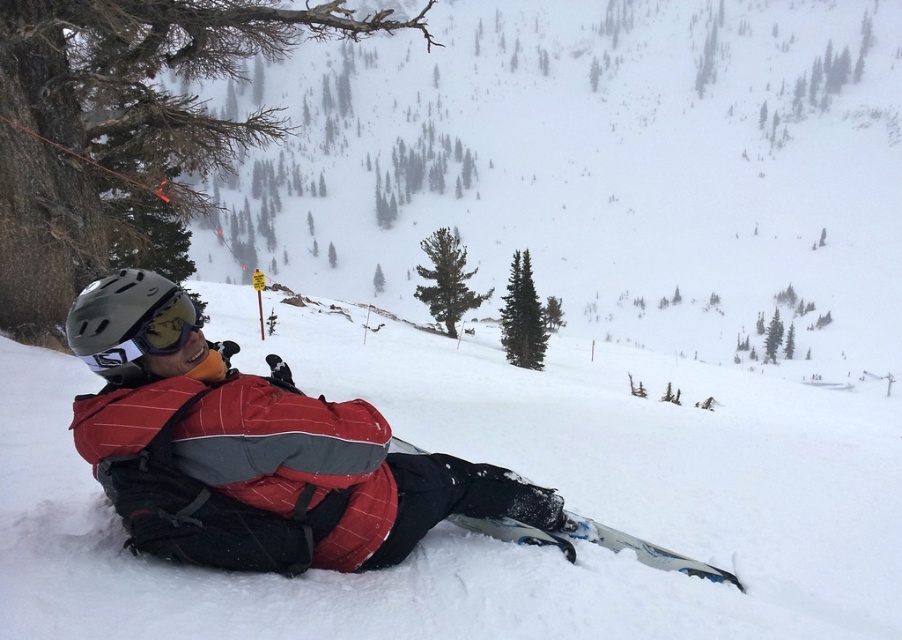
You are a photographer trying to capture the red matte jacket at center and the blue metallic ski at lower right in the same frame. Based on their positions, which object should you adjust your camera to focus on first to ensure both are in the shot?

The red matte jacket at center is to the left of the blue metallic ski at lower right, so you should focus on the blue metallic ski at lower right first to ensure both are in the frame.

You are a photographer trying to capture the scene of the red matte jacket at center and the blue metallic ski at lower right. If you want to ensure both objects are fully visible in your photo, which object should you focus on to avoid cropping either one?

The red matte jacket at center has a larger width than the blue metallic ski at lower right. To ensure both are fully visible, focus on the red matte jacket at center as it requires more space in the frame.